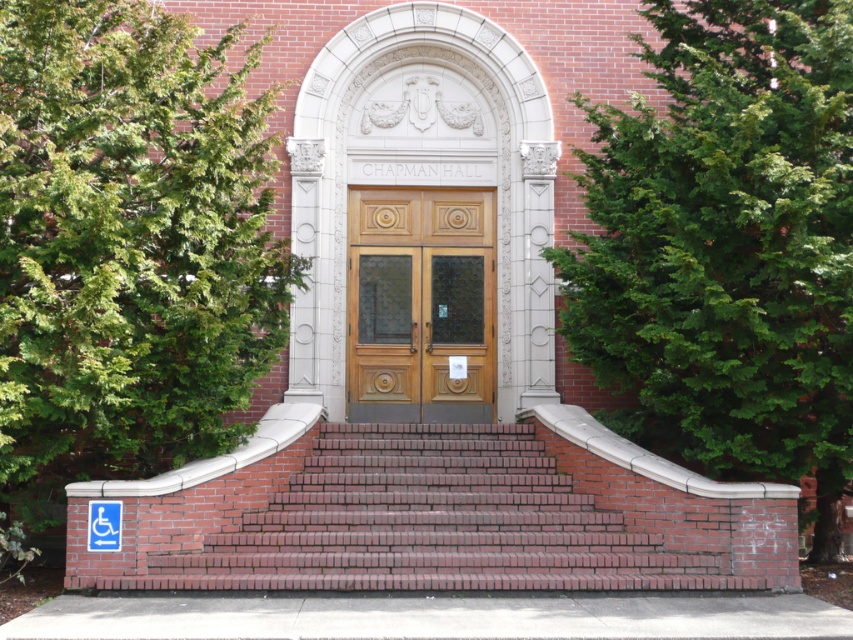
You are a visitor approaching Chapman Hall and see the green leafy tree at left and the brick stairs at center. Which object is closer to you as you walk towards the entrance?

The brick stairs at center are closer to you because the green leafy tree at left is positioned over them, indicating it is further back.